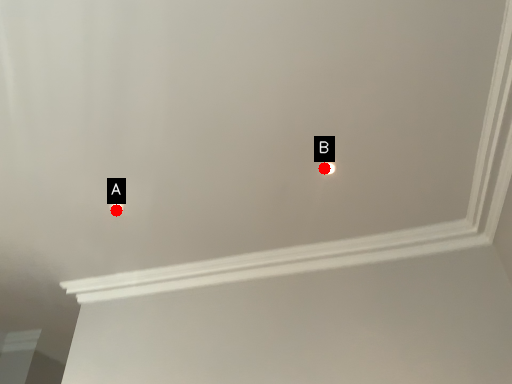
Question: Two points are circled on the image, labeled by A and B beside each circle. Which point appears farthest from the camera in this image?

Choices:
 (A) A is further
 (B) B is further

Answer: (A)